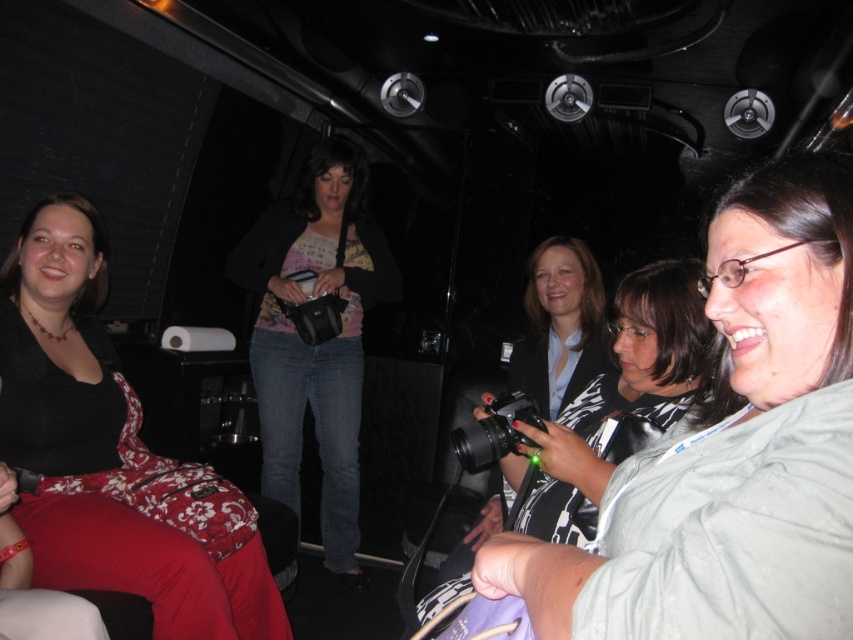
You are a photographer trying to capture a candid shot of the matte pink shirt at center and the black plastic camera at center. Since the lighting is low, you need to adjust your camera settings. To ensure both subjects are in frame, which direction should you pan your camera slightly?

You should pan your camera slightly to the right because the matte pink shirt at center is to the left of the black plastic camera at center, so moving the camera right will keep both in frame.

You are a photographer trying to decide which camera to use. Both the matte black camera at center and the black plastic camera at center are available. Which one is positioned lower?

The matte black camera at center is located below the black plastic camera at center, so it is positioned lower.

You are a photographer trying to capture a candid shot of the two women in the scene. The two cameras available are the matte black camera at center and the black plastic camera at center. Which camera should you choose if you want to blend in with the dark environment?

The matte black camera at center is positioned on the right side of black plastic camera at center. Since the environment is dark, the matte black camera at center would blend in better due to its darker color compared to the black plastic camera at center.